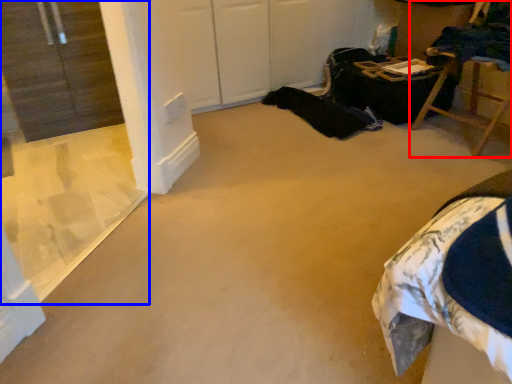
Question: Which object appears closest to the camera in this image, furniture (highlighted by a red box) or window (highlighted by a blue box)?

Choices:
 (A) furniture
 (B) window

Answer: (B)